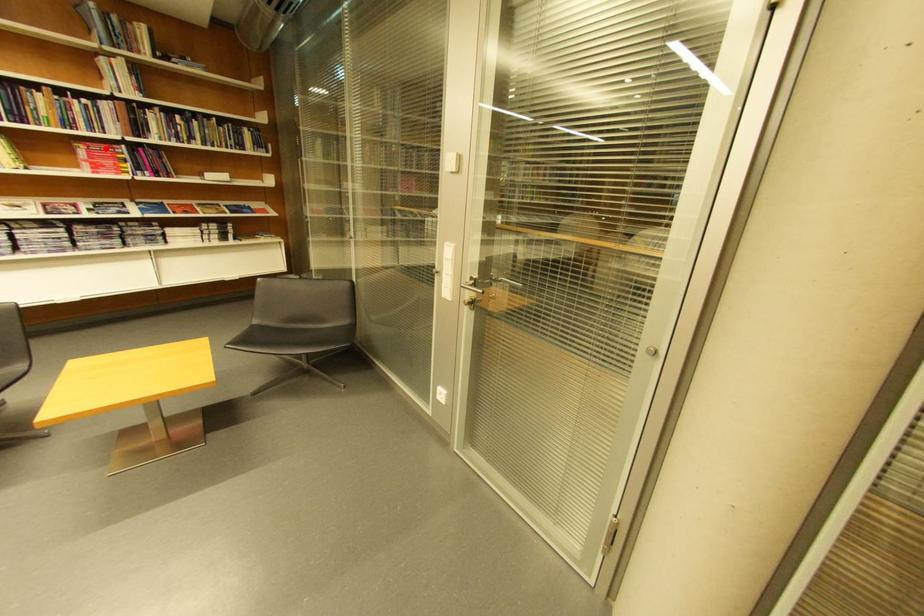
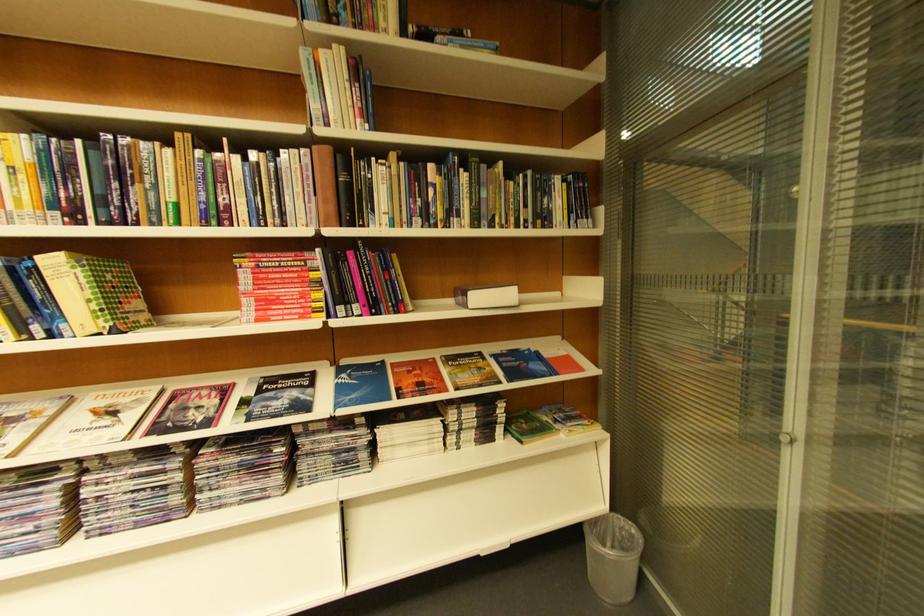
Question: I am providing you with two images of the same scene from different viewpoints. A red point is marked on the first image. At the location where the point appears in image 1, is it still visible in image 2?

Choices:
 (A) Yes
 (B) No

Answer: (A)